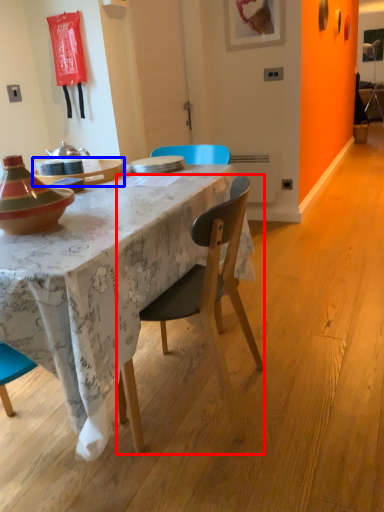
Question: Which object is further to the camera taking this photo, chair (highlighted by a red box) or table (highlighted by a blue box)?

Choices:
 (A) chair
 (B) table

Answer: (B)